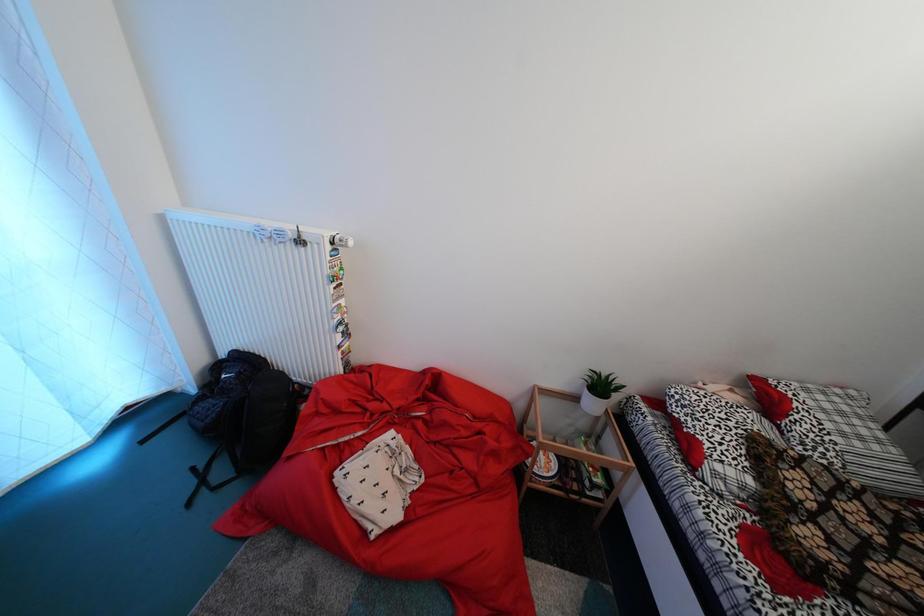
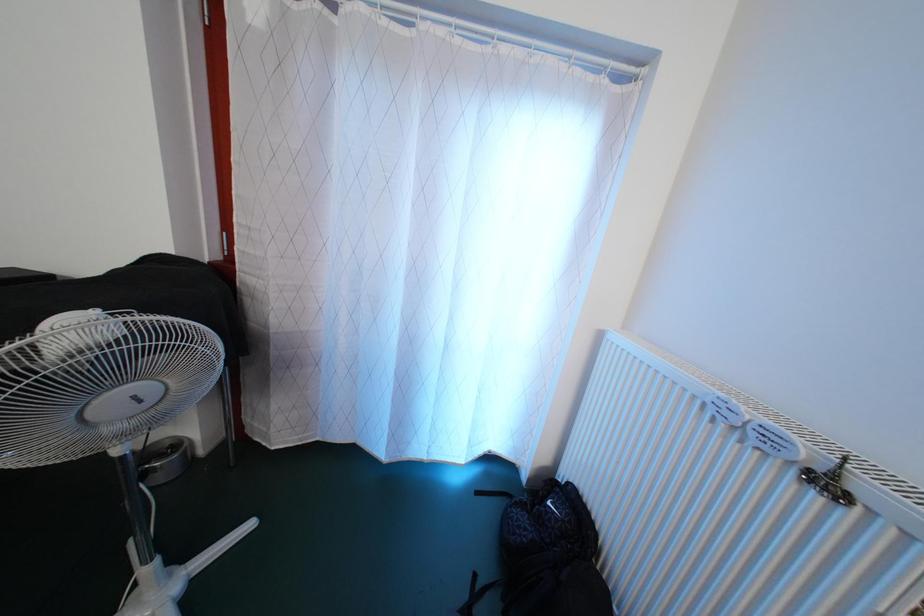
Question: The camera is either moving clockwise (left) or counter-clockwise (right) around the object. The first image is from the beginning of the video and the second image is from the end. Is the camera moving left or right when shooting the video?

Choices:
 (A) Left
 (B) Right

Answer: (B)